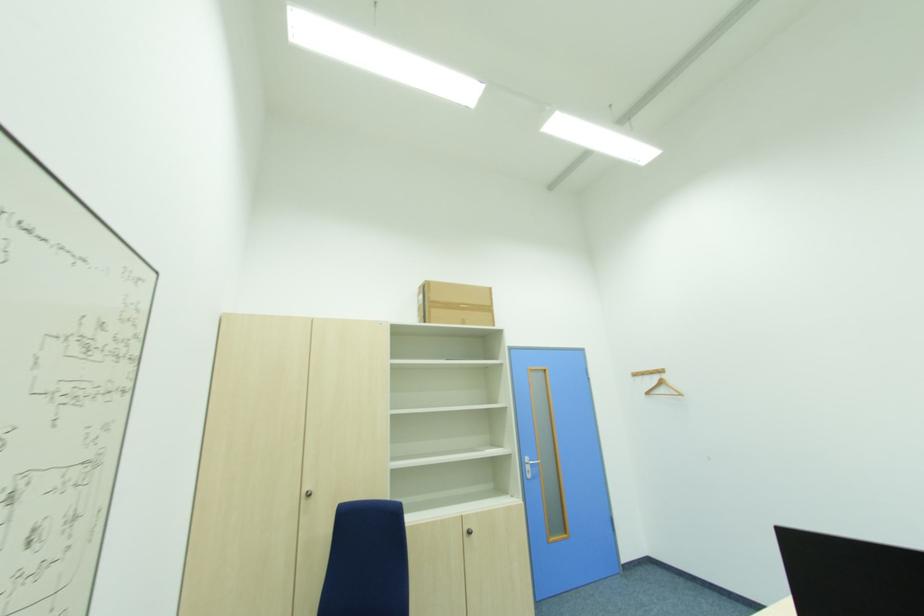
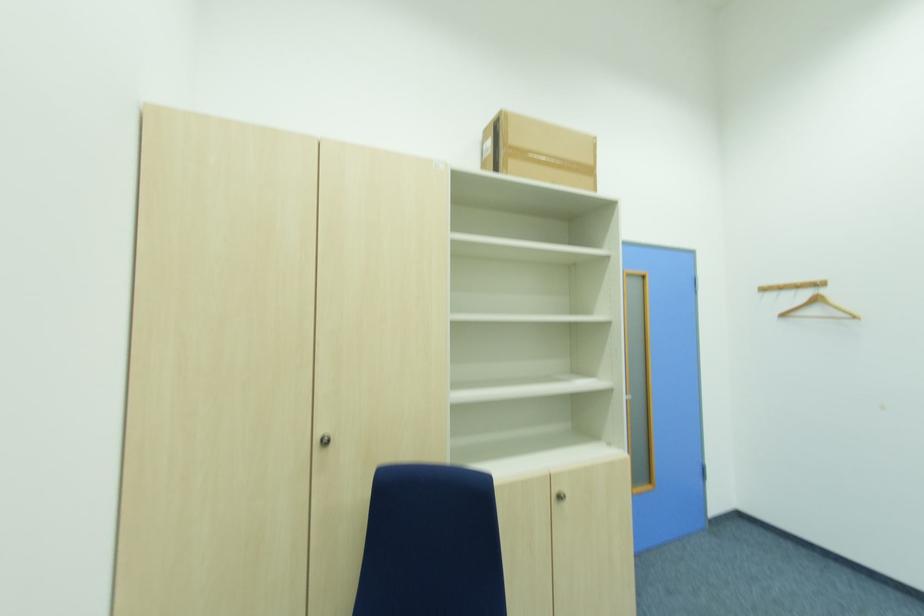
Based on the photo, what movement of the cameraman would produce the second image?

The cameraman moved toward left, forward.